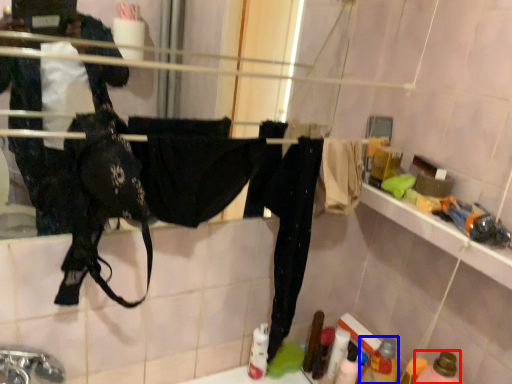
Question: Which object appears closest to the camera in this image, bottle (highlighted by a red box) or bottle (highlighted by a blue box)?

Choices:
 (A) bottle
 (B) bottle

Answer: (A)